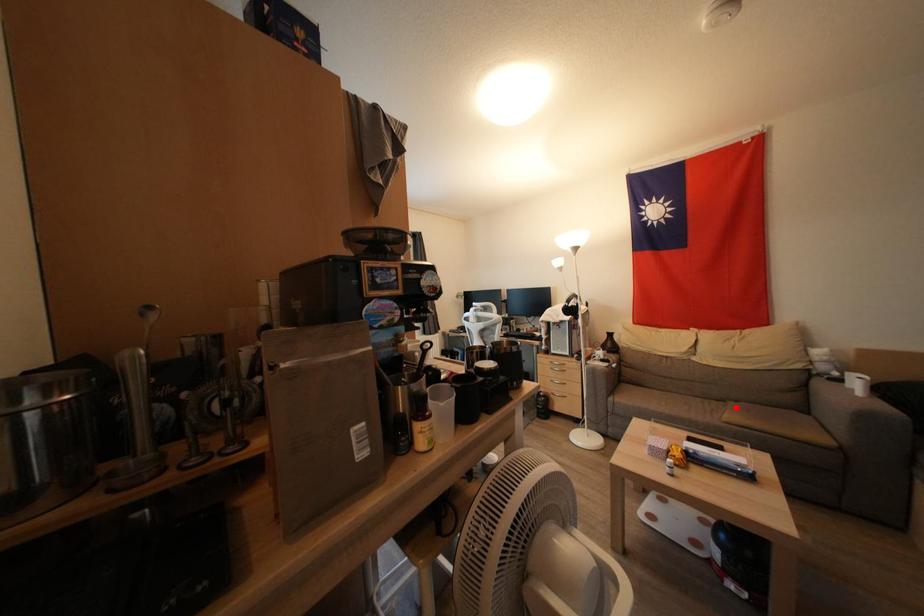
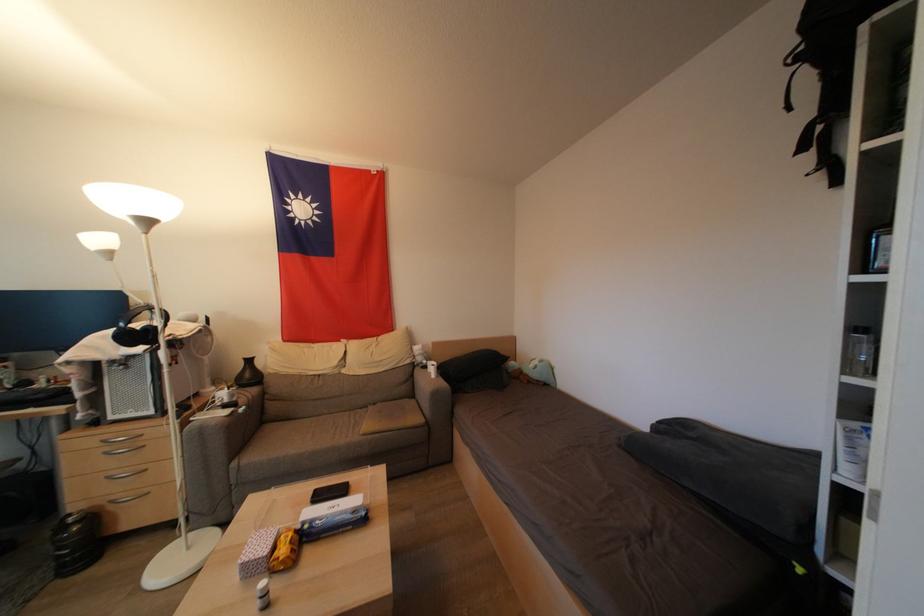
Locate, in the second image, the point that corresponds to the highlighted location in the first image.

(375, 411)